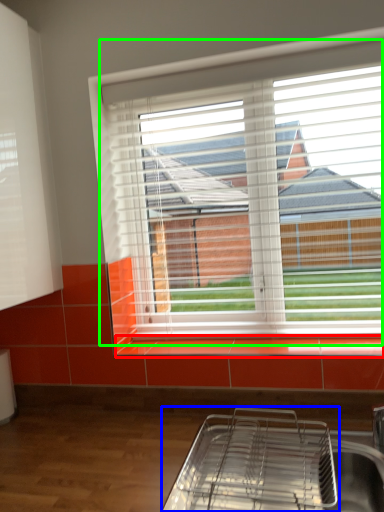
Question: Considering the real-world distances, which object is closest to window sill (highlighted by a red box)? appliance (highlighted by a blue box) or window (highlighted by a green box).

Choices:
 (A) appliance
 (B) window

Answer: (A)